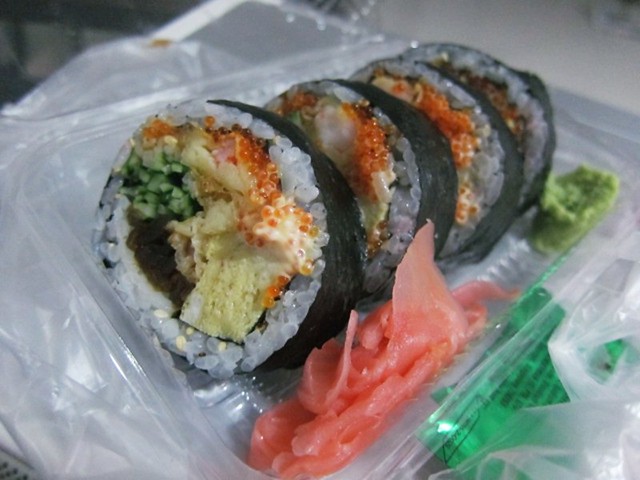
At what (x,y) coordinates should I click in order to perform the action: click on table. Please return your answer as a coordinate pair (x, y). This screenshot has width=640, height=480. Looking at the image, I should click on (557, 32).